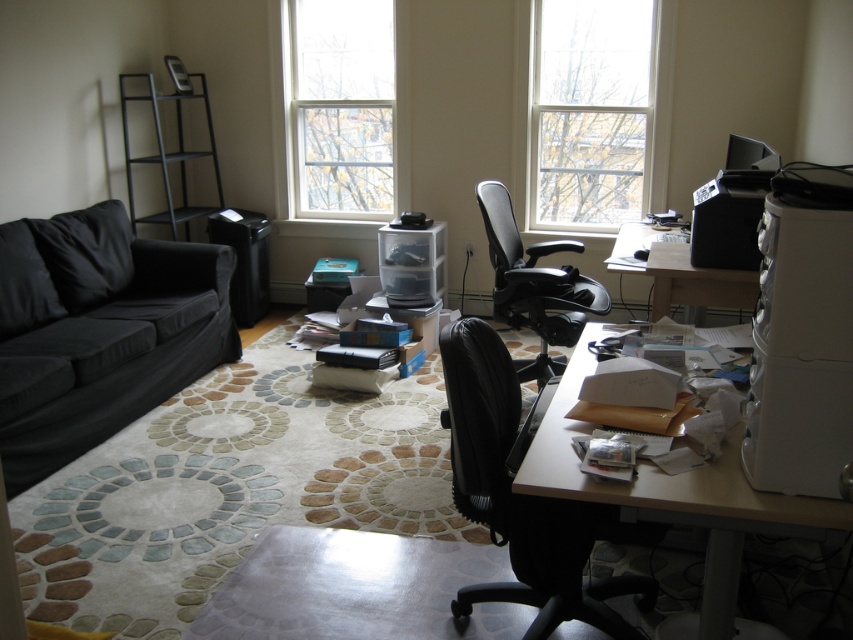
Is point (491, 490) less distant than point (550, 369)?

Yes.

The width and height of the screenshot is (853, 640). What do you see at coordinates (526, 499) in the screenshot? I see `black mesh swivel chair at center` at bounding box center [526, 499].

Is point (509, 483) more distant than point (575, 301)?

No, it is in front of (575, 301).

Locate an element on the screen. This screenshot has height=640, width=853. black mesh swivel chair at center is located at coordinates (526, 499).

Can you confirm if black fabric couch at left is positioned to the right of white frame window at upper center?

No, black fabric couch at left is not to the right of white frame window at upper center.

How distant is black fabric couch at left from white frame window at upper center?

black fabric couch at left is 2.22 meters from white frame window at upper center.

At what (x,y) coordinates should I click in order to perform the action: click on black fabric couch at left. Please return your answer as a coordinate pair (x, y). This screenshot has width=853, height=640. Looking at the image, I should click on (97, 332).

Where is `black fabric couch at left`? The image size is (853, 640). black fabric couch at left is located at coordinates (97, 332).

Which is above, transparent glass window at upper center or wooden desk at center?

transparent glass window at upper center is above.

Between transparent glass window at upper center and wooden desk at center, which one appears on the left side from the viewer's perspective?

wooden desk at center

The image size is (853, 640). What do you see at coordinates (590, 112) in the screenshot?
I see `transparent glass window at upper center` at bounding box center [590, 112].

The image size is (853, 640). What are the coordinates of `transparent glass window at upper center` in the screenshot? It's located at (590, 112).